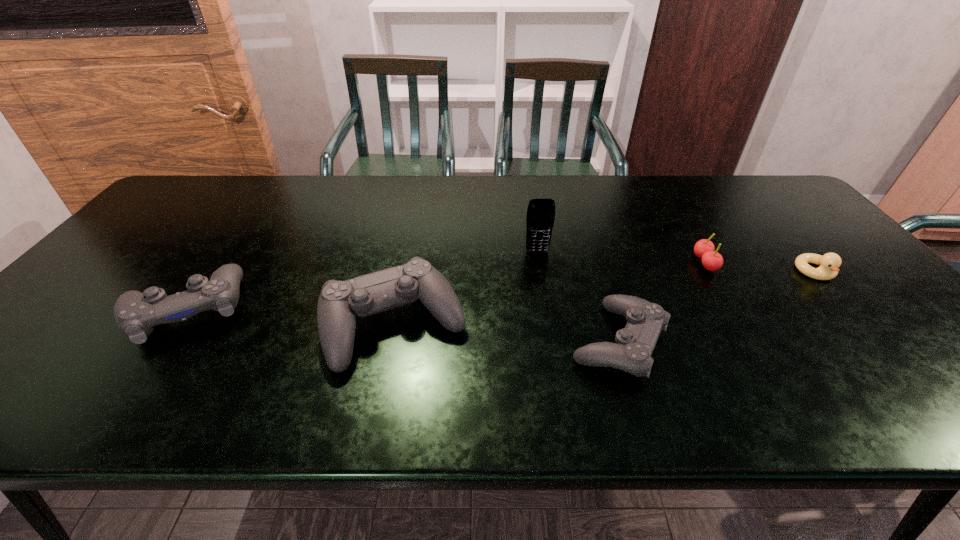
Locate an element on the screen. This screenshot has width=960, height=540. free space located 0.120m on the back of the second control from right to left is located at coordinates (409, 253).

In order to click on vacant area located 0.360m on the left of the rightmost control in this screenshot , I will do `click(409, 341)`.

Find the location of a particular element. free space located at the beak of the duckling is located at coordinates (845, 305).

You are a GUI agent. You are given a task and a screenshot of the screen. Output one action in this format:
    pyautogui.click(x=<x>, y=<y>)
    Task: Click on the vacant space situated on the screen of the cellular telephone
    The image size is (960, 540).
    Given the screenshot: What is the action you would take?
    pyautogui.click(x=547, y=312)

Locate an element on the screen. free region located 0.150m on the back of the cherry is located at coordinates (680, 221).

You are a GUI agent. You are given a task and a screenshot of the screen. Output one action in this format:
    pyautogui.click(x=<x>, y=<y>)
    Task: Click on the object at the right edge
    This screenshot has height=540, width=960.
    Given the screenshot: What is the action you would take?
    pyautogui.click(x=828, y=269)

Image resolution: width=960 pixels, height=540 pixels. I want to click on vacant space at the far edge of the desktop, so click(x=513, y=185).

Identify the location of vacant space at the near edge of the desktop. (222, 343).

The width and height of the screenshot is (960, 540). I want to click on free space at the left edge, so click(148, 220).

You are a GUI agent. You are given a task and a screenshot of the screen. Output one action in this format:
    pyautogui.click(x=<x>, y=<y>)
    Task: Click on the vacant space at the right edge of the desktop
    
    Given the screenshot: What is the action you would take?
    pyautogui.click(x=794, y=226)